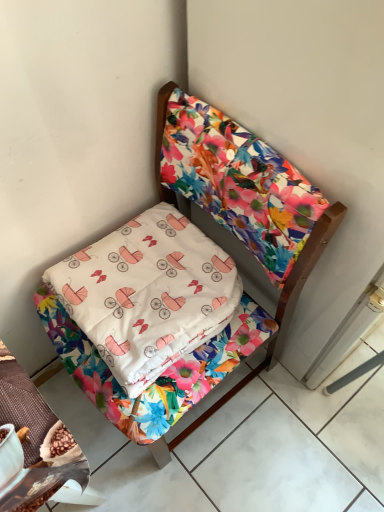
This screenshot has height=512, width=384. Describe the element at coordinates (148, 294) in the screenshot. I see `white cotton pillow at center` at that location.

Find the location of `white cotton pillow at center`. white cotton pillow at center is located at coordinates (148, 294).

Based on the photo, measure the distance between point (178,339) and camera.

34.13 inches.

In order to face floral fabric bed at upper right, should I rotate leftwards or rightwards?

To align with it, rotate left about 4.671°.

Image resolution: width=384 pixels, height=512 pixels. Describe the element at coordinates (275, 319) in the screenshot. I see `floral fabric bed at upper right` at that location.

Find the location of `floral fabric bed at upper right`. floral fabric bed at upper right is located at coordinates (275, 319).

This screenshot has width=384, height=512. Find the location of `white cotton pillow at center`. white cotton pillow at center is located at coordinates [148, 294].

Visually, is white cotton pillow at center positioned to the left or to the right of floral fabric bed at upper right?

From the image, it's evident that white cotton pillow at center is to the left of floral fabric bed at upper right.

In the image, is white cotton pillow at center positioned in front of or behind floral fabric bed at upper right?

white cotton pillow at center is behind floral fabric bed at upper right.

Which is behind, point (183, 294) or point (283, 329)?

Point (283, 329)

From the image's perspective, which is below, white cotton pillow at center or floral fabric bed at upper right?

From the image's view, floral fabric bed at upper right is below.

From a real-world perspective, between white cotton pillow at center and floral fabric bed at upper right, who is vertically lower?

floral fabric bed at upper right is physically lower.

Between white cotton pillow at center and floral fabric bed at upper right, which one has larger width?

Wider between the two is floral fabric bed at upper right.

Is white cotton pillow at center taller than floral fabric bed at upper right?

Incorrect, the height of white cotton pillow at center is not larger of that of floral fabric bed at upper right.

Is white cotton pillow at center bigger than floral fabric bed at upper right?

Actually, white cotton pillow at center might be smaller than floral fabric bed at upper right.

Is floral fabric bed at upper right a part of white cotton pillow at center?

No, floral fabric bed at upper right is not surrounded by white cotton pillow at center.

Can you see white cotton pillow at center touching floral fabric bed at upper right?

No, white cotton pillow at center is not next to floral fabric bed at upper right.

Is white cotton pillow at center oriented towards floral fabric bed at upper right?

Yes, white cotton pillow at center is oriented towards floral fabric bed at upper right.

How many degrees apart are the facing directions of white cotton pillow at center and floral fabric bed at upper right?

They differ by 89 degrees in their facing directions.

Based on the photo, measure the distance between white cotton pillow at center and floral fabric bed at upper right.

The distance of white cotton pillow at center from floral fabric bed at upper right is 11.81 inches.

Locate an element on the screen. furniture below the white cotton pillow at center (from the image's perspective) is located at coordinates (275, 319).

Between floral fabric bed at upper right and white cotton pillow at center, which one appears on the left side from the viewer's perspective?

white cotton pillow at center is more to the left.

Is the depth of floral fabric bed at upper right less than that of white cotton pillow at center?

Yes, it is.

Which point is more distant from viewer, (296, 264) or (211, 260)?

The point (211, 260) is farther.

From the image's perspective, is floral fabric bed at upper right under white cotton pillow at center?

Indeed, from the image's perspective, floral fabric bed at upper right is shown beneath white cotton pillow at center.

From a real-world perspective, is floral fabric bed at upper right positioned under white cotton pillow at center based on gravity?

Yes, from a real-world perspective, floral fabric bed at upper right is under white cotton pillow at center.

Is floral fabric bed at upper right wider than white cotton pillow at center?

Yes, floral fabric bed at upper right is wider than white cotton pillow at center.

Is floral fabric bed at upper right shorter than white cotton pillow at center?

Incorrect, the height of floral fabric bed at upper right does not fall short of that of white cotton pillow at center.

Looking at this image, in terms of size, does floral fabric bed at upper right appear bigger or smaller than white cotton pillow at center?

Considering their sizes, floral fabric bed at upper right takes up more space than white cotton pillow at center.

Is floral fabric bed at upper right outside of white cotton pillow at center?

Yes, floral fabric bed at upper right is outside of white cotton pillow at center.

Is floral fabric bed at upper right far away from white cotton pillow at center?

No, floral fabric bed at upper right is not far away from white cotton pillow at center.

Could you tell me if floral fabric bed at upper right is facing white cotton pillow at center?

Yes, floral fabric bed at upper right is oriented towards white cotton pillow at center.

How many degrees apart are the facing directions of floral fabric bed at upper right and white cotton pillow at center?

floral fabric bed at upper right and white cotton pillow at center are facing 89 degrees away from each other.

Measure the distance between floral fabric bed at upper right and white cotton pillow at center.

floral fabric bed at upper right and white cotton pillow at center are 11.81 inches apart.

At what (x,y) coordinates should I click in order to perform the action: click on pillow that is behind the floral fabric bed at upper right. Please return your answer as a coordinate pair (x, y). Looking at the image, I should click on (148, 294).

Where is `furniture that is on the right side of white cotton pillow at center`? The image size is (384, 512). furniture that is on the right side of white cotton pillow at center is located at coordinates (275, 319).

Find the location of a particular element. pillow above the floral fabric bed at upper right (from the image's perspective) is located at coordinates (148, 294).